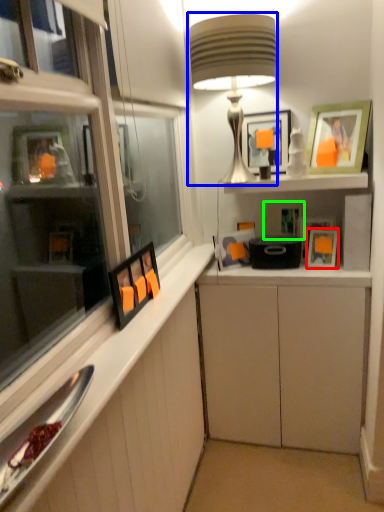
Question: Which object is positioned farthest from picture frame (highlighted by a red box)? Select from table lamp (highlighted by a blue box) and picture frame (highlighted by a green box).

Choices:
 (A) table lamp
 (B) picture frame

Answer: (A)